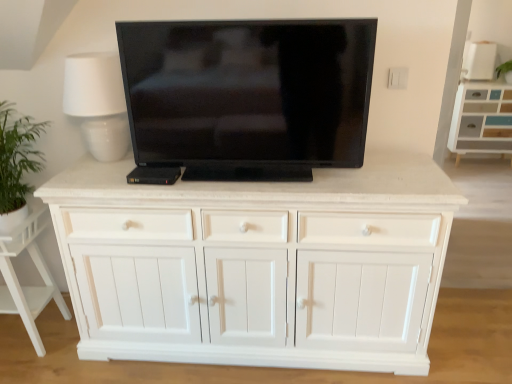
Describe the element at coordinates (246, 97) in the screenshot. I see `black glossy tv at center` at that location.

This screenshot has width=512, height=384. Describe the element at coordinates (481, 119) in the screenshot. I see `white wood cabinet at upper right` at that location.

Locate an element on the screen. Image resolution: width=512 pixels, height=384 pixels. white ceramic table lamp at upper left is located at coordinates (98, 103).

Considering the relative sizes of white wood cabinet at lower left and white wood cabinet at upper right in the image provided, is white wood cabinet at lower left smaller than white wood cabinet at upper right?

Indeed, white wood cabinet at lower left has a smaller size compared to white wood cabinet at upper right.

Would you say white wood cabinet at lower left is to the left or to the right of white wood cabinet at upper right in the picture?

Clearly, white wood cabinet at lower left is on the left of white wood cabinet at upper right in the image.

Is point (15, 299) more distant than point (503, 94)?

No.

Is black glossy tv at center placed right next to white ceramic table lamp at upper left?

black glossy tv at center and white ceramic table lamp at upper left are clearly separated.

Measure the distance between black glossy tv at center and white ceramic table lamp at upper left.

black glossy tv at center is 15.64 inches away from white ceramic table lamp at upper left.

Does black glossy tv at center have a larger size compared to white ceramic table lamp at upper left?

Indeed, black glossy tv at center has a larger size compared to white ceramic table lamp at upper left.

Where is `television below the white ceramic table lamp at upper left (from the image's perspective)`? This screenshot has height=384, width=512. television below the white ceramic table lamp at upper left (from the image's perspective) is located at coordinates (246, 97).

From the image's perspective, between white ceramic table lamp at upper left and white wood cabinet at upper right, who is located below?

white ceramic table lamp at upper left, from the image's perspective.

Between white ceramic table lamp at upper left and white wood cabinet at upper right, which one appears on the right side from the viewer's perspective?

Positioned to the right is white wood cabinet at upper right.

Would you say white ceramic table lamp at upper left is a long distance from white wood cabinet at upper right?

Yes, white ceramic table lamp at upper left and white wood cabinet at upper right are quite far apart.

Which of these two, white ceramic table lamp at upper left or white wood cabinet at upper right, is thinner?

white ceramic table lamp at upper left is thinner.

Is white ceramic table lamp at upper left spatially inside black glossy tv at center, or outside of it?

white ceramic table lamp at upper left is not enclosed by black glossy tv at center.

Which of these two, white ceramic table lamp at upper left or black glossy tv at center, is wider?

white ceramic table lamp at upper left.

From the image's perspective, relative to black glossy tv at center, is white ceramic table lamp at upper left above or below?

white ceramic table lamp at upper left is situated higher than black glossy tv at center in the image.

Considering the sizes of objects white ceramic table lamp at upper left and black glossy tv at center in the image provided, who is smaller, white ceramic table lamp at upper left or black glossy tv at center?

Smaller between the two is white ceramic table lamp at upper left.

Is white wood cabinet at upper right spatially inside black glossy tv at center, or outside of it?

The correct answer is: outside.

Can you tell me how much white wood cabinet at upper right and black glossy tv at center differ in facing direction?

There is a 2.33-degree angle between the facing directions of white wood cabinet at upper right and black glossy tv at center.

Between white wood cabinet at upper right and black glossy tv at center, which one has more height?

Standing taller between the two is white wood cabinet at upper right.

Would you say white wood cabinet at upper right is inside or outside white wood cabinet at lower left?

white wood cabinet at upper right is spatially situated outside white wood cabinet at lower left.

Who is taller, white wood cabinet at upper right or white wood cabinet at lower left?

With more height is white wood cabinet at upper right.

Which of these two, white wood cabinet at upper right or white wood cabinet at lower left, is wider?

Wider between the two is white wood cabinet at lower left.

In the scene shown: Is white wood cabinet at upper right bigger than white wood cabinet at lower left?

Yes.

Is white ceramic table lamp at upper left oriented towards white wood cabinet at lower left?

No, white ceramic table lamp at upper left is not turned towards white wood cabinet at lower left.

Is white ceramic table lamp at upper left next to white wood cabinet at lower left?

No, white ceramic table lamp at upper left is not with white wood cabinet at lower left.

Can you confirm if white ceramic table lamp at upper left is smaller than white wood cabinet at lower left?

Yes, white ceramic table lamp at upper left is smaller than white wood cabinet at lower left.

From the image's perspective, relative to white wood cabinet at lower left, is white ceramic table lamp at upper left above or below?

Based on their image positions, white ceramic table lamp at upper left is located above white wood cabinet at lower left.

The image size is (512, 384). What are the coordinates of `cabinetry that appears above the white wood cabinet at lower left (from the image's perspective)` in the screenshot? It's located at (481, 119).

Where is `table lamp that appears behind the black glossy tv at center`? table lamp that appears behind the black glossy tv at center is located at coordinates click(x=98, y=103).

Considering their positions, is white wood cabinet at lower left positioned closer to white ceramic table lamp at upper left than black glossy tv at center?

black glossy tv at center is positioned closer to the anchor white ceramic table lamp at upper left.

Estimate the real-world distances between objects in this image. Which object is closer to black glossy tv at center, white wood cabinet at lower left or white ceramic table lamp at upper left?

white ceramic table lamp at upper left is closer to black glossy tv at center.

Looking at the image, which one is located further to black glossy tv at center, white wood cabinet at lower left or white wood cabinet at upper right?

white wood cabinet at upper right is further to black glossy tv at center.

Estimate the real-world distances between objects in this image. Which object is closer to black glossy tv at center, white ceramic table lamp at upper left or white wood cabinet at upper right?

white ceramic table lamp at upper left is closer to black glossy tv at center.

Which object lies further to the anchor point white wood cabinet at lower left, white ceramic table lamp at upper left or black glossy tv at center?

black glossy tv at center is positioned further to the anchor white wood cabinet at lower left.

When comparing their distances from white wood cabinet at lower left, does white wood cabinet at upper right or black glossy tv at center seem closer?

Based on the image, black glossy tv at center appears to be nearer to white wood cabinet at lower left.

Looking at the image, which one is located further to white ceramic table lamp at upper left, black glossy tv at center or white wood cabinet at lower left?

Based on the image, white wood cabinet at lower left appears to be further to white ceramic table lamp at upper left.

When comparing their distances from white wood cabinet at upper right, does white ceramic table lamp at upper left or white wood cabinet at lower left seem further?

white wood cabinet at lower left lies further to white wood cabinet at upper right than the other object.

Find the location of a particular element. The width and height of the screenshot is (512, 384). table lamp located between white wood cabinet at lower left and black glossy tv at center in the left-right direction is located at coordinates (98, 103).

Where is `table lamp between white wood cabinet at lower left and white wood cabinet at upper right`? The width and height of the screenshot is (512, 384). table lamp between white wood cabinet at lower left and white wood cabinet at upper right is located at coordinates (98, 103).

I want to click on television between white wood cabinet at lower left and white wood cabinet at upper right from left to right, so click(246, 97).

Where is `television between white ceramic table lamp at upper left and white wood cabinet at upper right from left to right`? television between white ceramic table lamp at upper left and white wood cabinet at upper right from left to right is located at coordinates (246, 97).